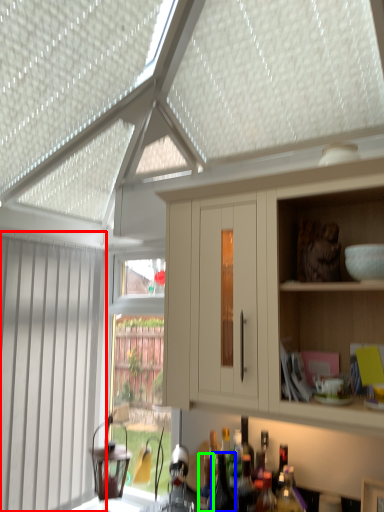
Question: Considering the real-world distances, which object is farthest from window (highlighted by a red box)? bottle (highlighted by a blue box) or bottle (highlighted by a green box)?

Choices:
 (A) bottle
 (B) bottle

Answer: (A)